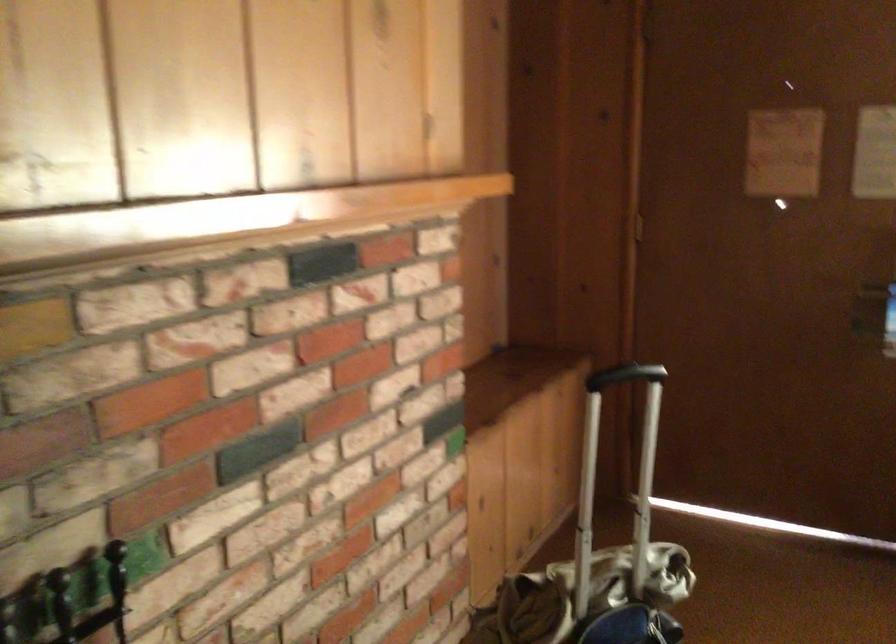
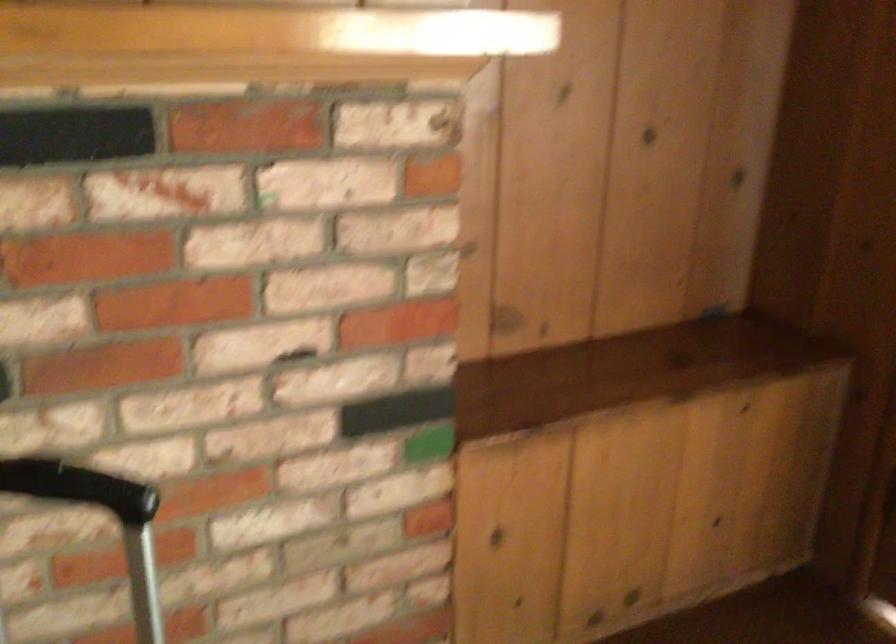
In the second image, find the point that corresponds to (487,391) in the first image.

(625, 371)